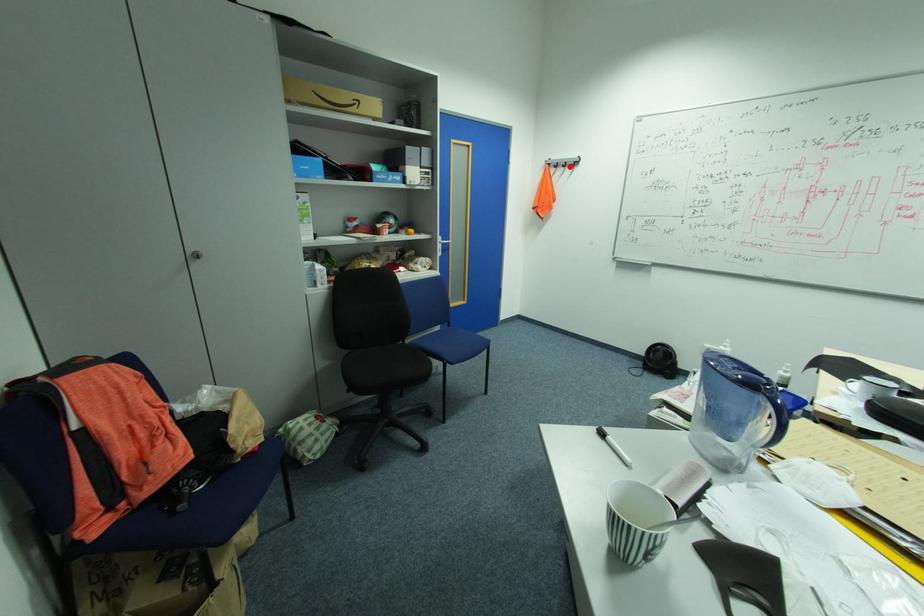
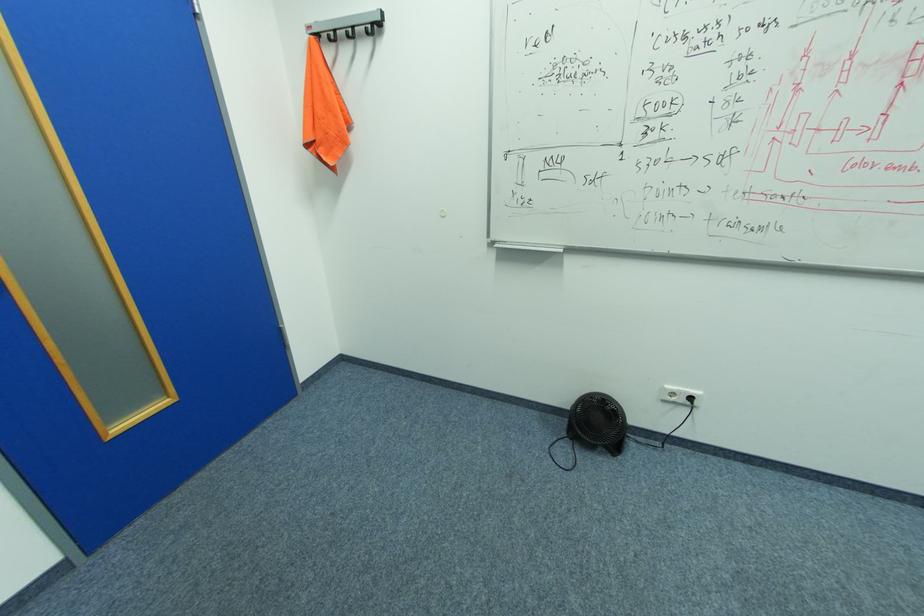
Question: I am providing you with two images of the same scene from different viewpoints. A red point is shown in image1. For the corresponding object point in image2, is it positioned nearer or farther from the camera?

Choices:
 (A) Nearer
 (B) Farther

Answer: (B)